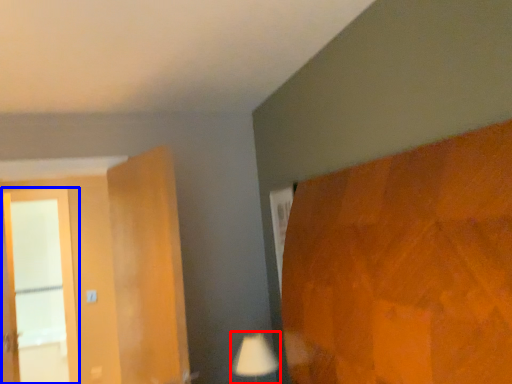
Question: Which object is further to the camera taking this photo, table lamp (highlighted by a red box) or screen door (highlighted by a blue box)?

Choices:
 (A) table lamp
 (B) screen door

Answer: (B)